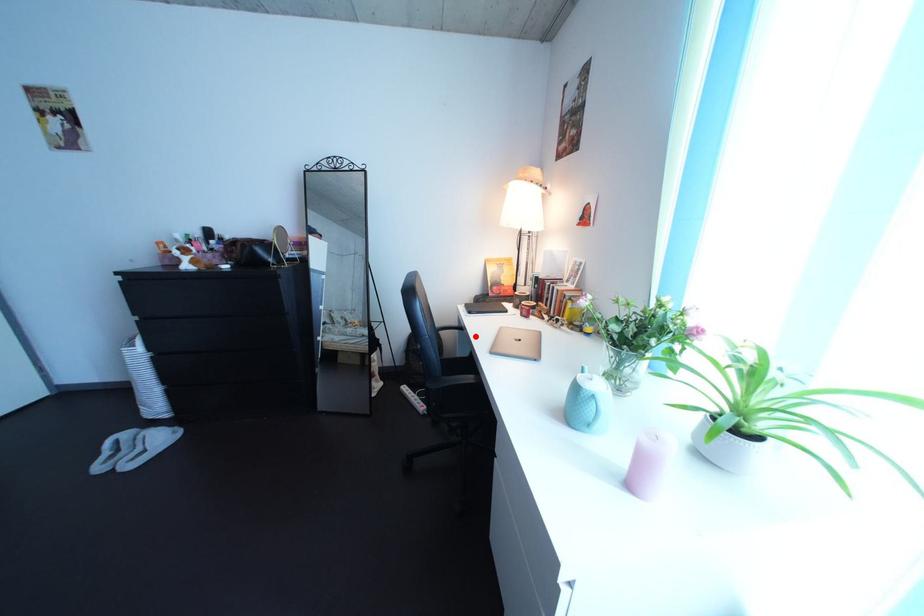
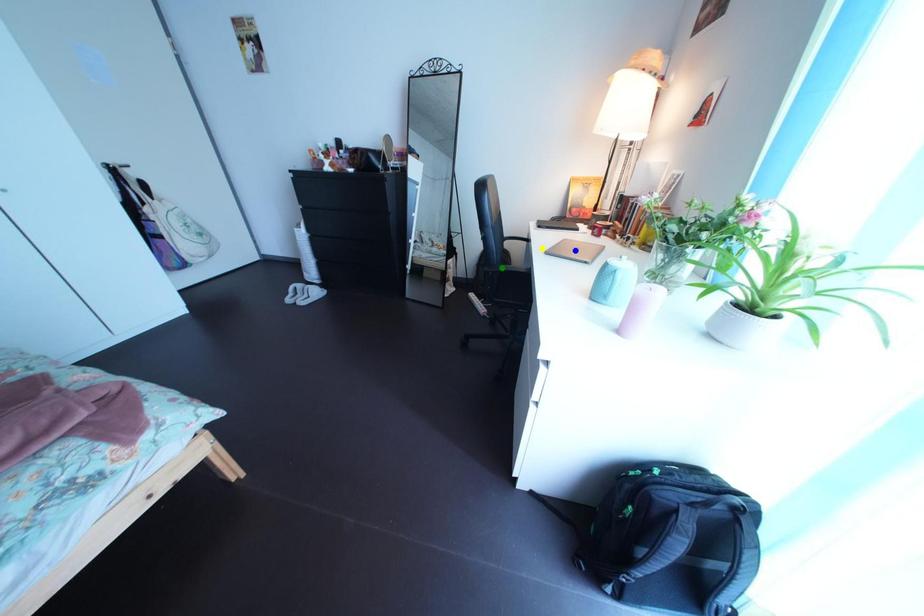
Question: I am providing you with two images of the same scene from different viewpoints. A red point is marked on the first image. You are given multiple points on the second image. In image 2, which mark is for the same physical point as the one in image 1?

Choices:
 (A) yellow point
 (B) green point
 (C) blue point

Answer: (A)